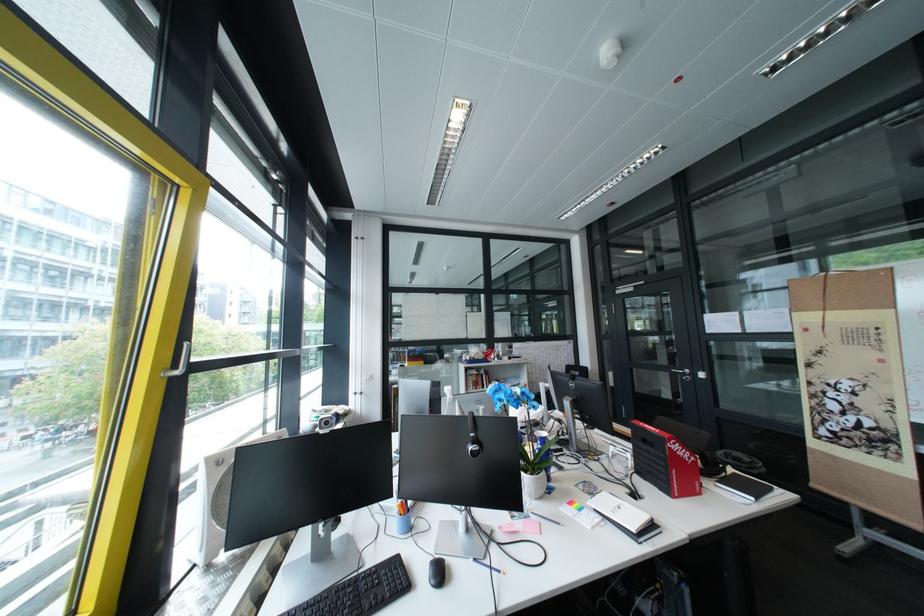
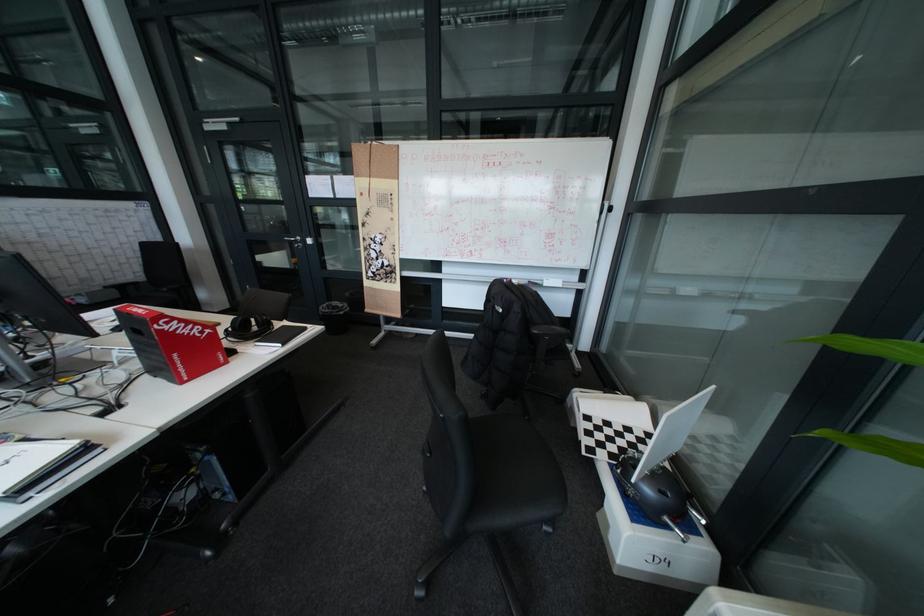
Where in the second image is the point corresponding to point 687,371 from the first image?

(299, 238)